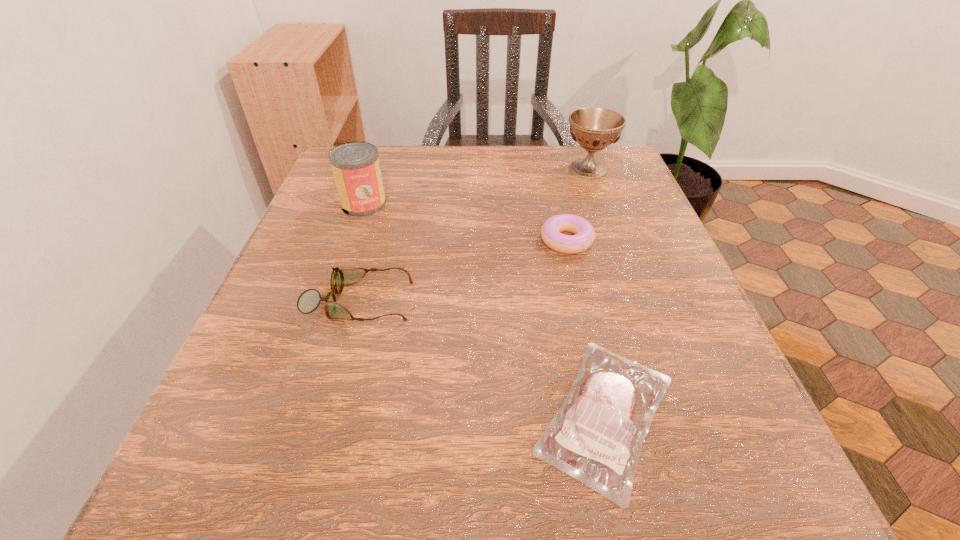
The height and width of the screenshot is (540, 960). I want to click on free space between the farthest object and the third nearest object, so click(577, 205).

Find the location of a particular element. This screenshot has width=960, height=540. empty space between the farthest object and the fourth nearest object is located at coordinates (476, 186).

At what (x,y) coordinates should I click in order to perform the action: click on empty space between the fourth nearest object and the third nearest object. Please return your answer as a coordinate pair (x, y). The image size is (960, 540). Looking at the image, I should click on (465, 222).

Where is `free area in between the steak and the farthest object`? The width and height of the screenshot is (960, 540). free area in between the steak and the farthest object is located at coordinates (597, 292).

At what (x,y) coordinates should I click in order to perform the action: click on free space between the fourth nearest object and the steak. Please return your answer as a coordinate pair (x, y). Image resolution: width=960 pixels, height=540 pixels. Looking at the image, I should click on (485, 309).

Image resolution: width=960 pixels, height=540 pixels. I want to click on vacant point located between the nearest object and the can, so click(x=485, y=309).

This screenshot has height=540, width=960. I want to click on free spot between the spectacles and the can, so click(362, 253).

The width and height of the screenshot is (960, 540). What are the coordinates of `vacant region between the shortest object and the doughnut` in the screenshot? It's located at (586, 327).

Image resolution: width=960 pixels, height=540 pixels. What are the coordinates of `vacant space in between the second shortest object and the chalice` in the screenshot? It's located at (577, 205).

The image size is (960, 540). I want to click on free space between the fourth farthest object and the chalice, so click(474, 235).